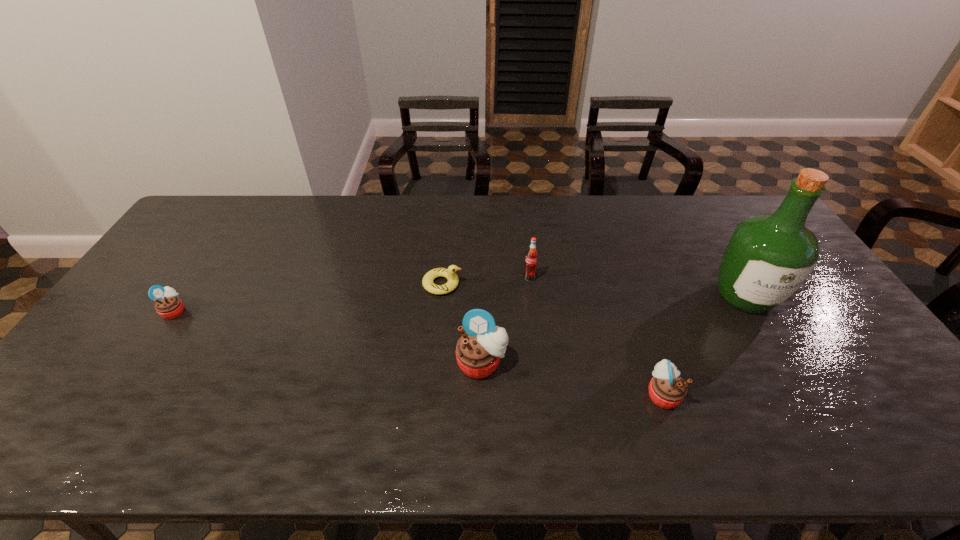
Where is `vacant region between the tallest object and the shortest object`? The width and height of the screenshot is (960, 540). vacant region between the tallest object and the shortest object is located at coordinates (593, 291).

Identify which object is the fifth closest to the liquor. Please provide its 2D coordinates. Your answer should be formatted as a tuple, i.e. [(x, y)], where the tuple contains the x and y coordinates of a point satisfying the conditions above.

[(168, 305)]

Select which object appears as the closest to the leftmost muffin. Please provide its 2D coordinates. Your answer should be formatted as a tuple, i.e. [(x, y)], where the tuple contains the x and y coordinates of a point satisfying the conditions above.

[(449, 273)]

Find the location of `muffin that stands as the closest to the duckling`. muffin that stands as the closest to the duckling is located at coordinates (478, 351).

At what (x,y) coordinates should I click in order to perform the action: click on muffin that stands as the closest to the soda bottle. Please return your answer as a coordinate pair (x, y). Image resolution: width=960 pixels, height=540 pixels. Looking at the image, I should click on (478, 351).

Identify the location of vacant area that satisfies the following two spatial constraints: 1. on the label of the third object from right to left; 2. on the front-facing side of the farthest muffin. (534, 311).

Image resolution: width=960 pixels, height=540 pixels. What are the coordinates of `free space in the image that satisfies the following two spatial constraints: 1. on the front-facing side of the rightmost object; 2. on the front-facing side of the rightmost muffin` in the screenshot? It's located at (802, 394).

What are the coordinates of `blank space that satisfies the following two spatial constraints: 1. on the front-facing side of the rightmost object; 2. on the front-facing side of the third shortest object` in the screenshot? It's located at (802, 394).

In order to click on free space that satisfies the following two spatial constraints: 1. on the front-facing side of the rightmost object; 2. on the front-facing side of the farthest muffin in this screenshot , I will do `click(753, 311)`.